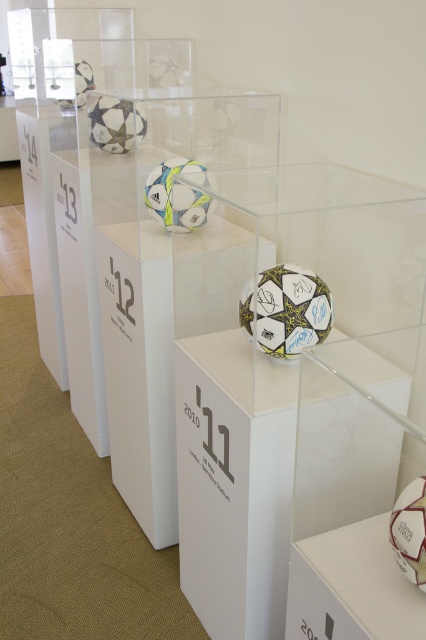
You are a museum curator arranging a new exhibit about soccer ball evolution. You have two soccer balls to place in the central display case. The clear acrylic ball at center and the white matte football at center. Given their sizes, which one should you place on the pedestal to ensure it is more prominent and draws attention?

The clear acrylic ball at center is larger in size than the white matte football at center, so placing the clear acrylic ball at center on the pedestal will make it more prominent and draw more attention.

You are a museum visitor standing in front of the soccer ball display. You see the clear acrylic ball at center and the white matte soccer ball at upper left. Which one is located to the right of the other?

The clear acrylic ball at center is positioned on the right side of white matte soccer ball at upper left.